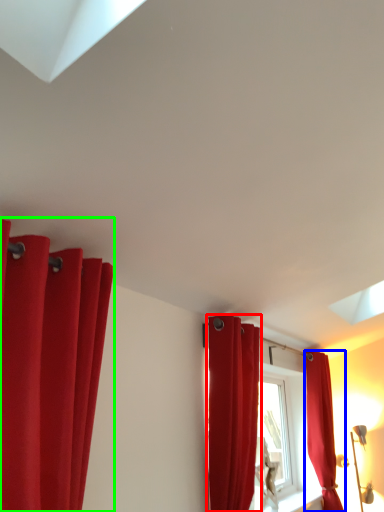
Question: Based on their relative distances, which object is nearer to curtain (highlighted by a red box)? Choose from curtain (highlighted by a blue box) and curtain (highlighted by a green box).

Choices:
 (A) curtain
 (B) curtain

Answer: (B)